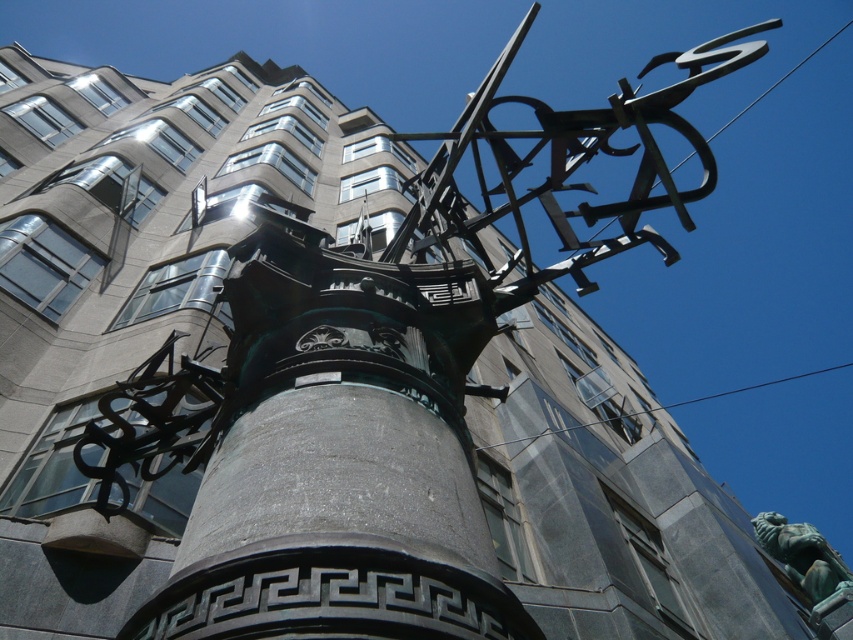
Question: Which point is farther to the camera?

Choices:
 (A) green patina stone pillar at center
 (B) green patina statue at lower right

Answer: (B)

Question: Among these objects, which one is nearest to the camera?

Choices:
 (A) green patina statue at lower right
 (B) green patina stone pillar at center

Answer: (B)

Question: Observing the image, what is the correct spatial positioning of green patina stone pillar at center in reference to green patina statue at lower right?

Choices:
 (A) right
 (B) left

Answer: (B)

Question: Which object appears farthest from the camera in this image?

Choices:
 (A) green patina stone pillar at center
 (B) green patina statue at lower right

Answer: (B)

Question: Is green patina stone pillar at center further to camera compared to green patina statue at lower right?

Choices:
 (A) no
 (B) yes

Answer: (A)

Question: Can you confirm if green patina stone pillar at center is positioned below green patina statue at lower right?

Choices:
 (A) yes
 (B) no

Answer: (B)